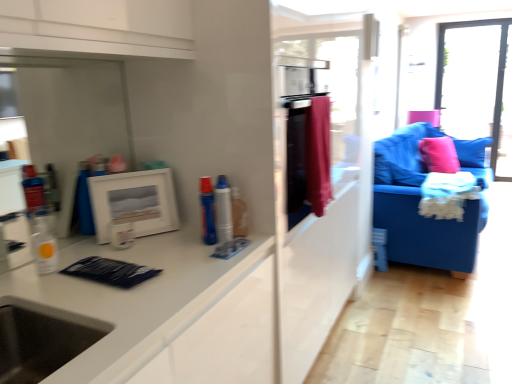
Question: Is blue plastic toothpaste at center, which appears as the 2th toiletry when viewed from the right, next to transparent plastic bottle at left, placed as the 3th toiletry when sorted from right to left?

Choices:
 (A) no
 (B) yes

Answer: (A)

Question: Is blue plastic toothpaste at center, the 2th toiletry when ordered from left to right, taller than transparent plastic bottle at left, placed as the 3th toiletry when sorted from right to left?

Choices:
 (A) yes
 (B) no

Answer: (A)

Question: Is blue plastic toothpaste at center, which appears as the 2th toiletry when viewed from the right, positioned behind transparent plastic bottle at left, acting as the 1th toiletry starting from the left?

Choices:
 (A) no
 (B) yes

Answer: (B)

Question: Is blue plastic toothpaste at center, which appears as the 2th toiletry when viewed from the right, wider than transparent plastic bottle at left, acting as the 1th toiletry starting from the left?

Choices:
 (A) yes
 (B) no

Answer: (B)

Question: Is transparent plastic bottle at left, acting as the 1th toiletry starting from the left, completely or partially inside blue plastic toothpaste at center, which appears as the 2th toiletry when viewed from the right?

Choices:
 (A) no
 (B) yes

Answer: (A)

Question: Would you say blue plastic toothpaste at center, the 2th toiletry when ordered from left to right, is outside transparent plastic bottle at left, placed as the 3th toiletry when sorted from right to left?

Choices:
 (A) no
 (B) yes

Answer: (B)

Question: From the image's perspective, is velvet red curtain at center on top of blue fabric couch at right?

Choices:
 (A) no
 (B) yes

Answer: (B)

Question: Can you confirm if velvet red curtain at center is positioned to the right of blue fabric couch at right?

Choices:
 (A) no
 (B) yes

Answer: (A)

Question: Is velvet red curtain at center bigger than blue fabric couch at right?

Choices:
 (A) no
 (B) yes

Answer: (A)

Question: Is velvet red curtain at center completely or partially outside of blue fabric couch at right?

Choices:
 (A) yes
 (B) no

Answer: (A)

Question: From the image's perspective, is velvet red curtain at center under blue fabric couch at right?

Choices:
 (A) no
 (B) yes

Answer: (A)

Question: Can you confirm if velvet red curtain at center is wider than blue fabric couch at right?

Choices:
 (A) no
 (B) yes

Answer: (A)

Question: Considering the relative sizes of blue plastic toothpaste at center, which appears as the 2th toiletry when viewed from the right, and transparent glass window at upper right in the image provided, is blue plastic toothpaste at center, which appears as the 2th toiletry when viewed from the right, wider than transparent glass window at upper right?

Choices:
 (A) no
 (B) yes

Answer: (A)